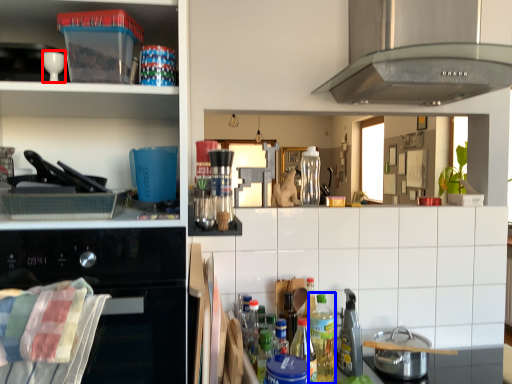
Question: Which point is further to the camera, appliance (highlighted by a red box) or bottle (highlighted by a blue box)?

Choices:
 (A) appliance
 (B) bottle

Answer: (B)